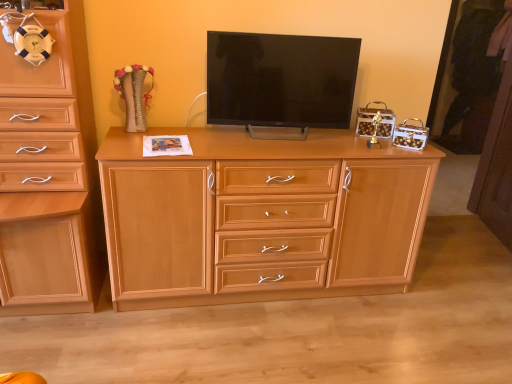
Image resolution: width=512 pixels, height=384 pixels. In order to click on light wood cabinet at left, arranged as the 2th chest of drawers when viewed from the right in this screenshot , I will do `click(49, 176)`.

Locate an element on the screen. This screenshot has width=512, height=384. light wood cabinet at left, the 1th chest of drawers from the left is located at coordinates (49, 176).

Is light wood chest of drawers at center, marked as the first chest of drawers in a right-to-left arrangement, positioned far away from light wood cabinet at left, the 1th chest of drawers from the left?

No, light wood chest of drawers at center, marked as the first chest of drawers in a right-to-left arrangement, is not far away from light wood cabinet at left, the 1th chest of drawers from the left.

Considering the relative positions of light wood chest of drawers at center, marked as the first chest of drawers in a right-to-left arrangement, and light wood cabinet at left, arranged as the 2th chest of drawers when viewed from the right, in the image provided, is light wood chest of drawers at center, marked as the first chest of drawers in a right-to-left arrangement, to the left or to the right of light wood cabinet at left, arranged as the 2th chest of drawers when viewed from the right,?

Based on their positions, light wood chest of drawers at center, marked as the first chest of drawers in a right-to-left arrangement, is located to the right of light wood cabinet at left, arranged as the 2th chest of drawers when viewed from the right.

Measure the distance between light wood chest of drawers at center, marked as the first chest of drawers in a right-to-left arrangement, and light wood cabinet at left, the 1th chest of drawers from the left.

light wood chest of drawers at center, marked as the first chest of drawers in a right-to-left arrangement, and light wood cabinet at left, the 1th chest of drawers from the left, are 64.28 centimeters apart.

Is light wood cabinet at left, arranged as the 2th chest of drawers when viewed from the right, next to light wood chest of drawers at center, placed as the second chest of drawers when sorted from left to right, and touching it?

There is a gap between light wood cabinet at left, arranged as the 2th chest of drawers when viewed from the right, and light wood chest of drawers at center, placed as the second chest of drawers when sorted from left to right.

Is light wood cabinet at left, the 1th chest of drawers from the left, to the left or to the right of light wood chest of drawers at center, placed as the second chest of drawers when sorted from left to right, in the image?

Clearly, light wood cabinet at left, the 1th chest of drawers from the left, is on the left of light wood chest of drawers at center, placed as the second chest of drawers when sorted from left to right, in the image.

Consider the image. From a real-world perspective, is light wood cabinet at left, arranged as the 2th chest of drawers when viewed from the right, positioned above or below light wood chest of drawers at center, placed as the second chest of drawers when sorted from left to right?

In terms of real-world spatial position, light wood cabinet at left, arranged as the 2th chest of drawers when viewed from the right, is above light wood chest of drawers at center, placed as the second chest of drawers when sorted from left to right.

Measure the distance between light wood cabinet at left, arranged as the 2th chest of drawers when viewed from the right, and light wood chest of drawers at center, marked as the first chest of drawers in a right-to-left arrangement.

light wood cabinet at left, arranged as the 2th chest of drawers when viewed from the right, and light wood chest of drawers at center, marked as the first chest of drawers in a right-to-left arrangement, are 25.31 inches apart.

Would you say matte black tv at center is part of light wood chest of drawers at center, marked as the first chest of drawers in a right-to-left arrangement,'s contents?

That's incorrect, matte black tv at center is not inside light wood chest of drawers at center, marked as the first chest of drawers in a right-to-left arrangement.

Considering the sizes of objects light wood chest of drawers at center, marked as the first chest of drawers in a right-to-left arrangement, and matte black tv at center in the image provided, who is taller, light wood chest of drawers at center, marked as the first chest of drawers in a right-to-left arrangement, or matte black tv at center?

With more height is light wood chest of drawers at center, marked as the first chest of drawers in a right-to-left arrangement.

Is light wood chest of drawers at center, marked as the first chest of drawers in a right-to-left arrangement, touching matte black tv at center?

No, light wood chest of drawers at center, marked as the first chest of drawers in a right-to-left arrangement, is not beside matte black tv at center.

What's the angular difference between light wood chest of drawers at center, placed as the second chest of drawers when sorted from left to right, and matte black tv at center's facing directions?

light wood chest of drawers at center, placed as the second chest of drawers when sorted from left to right, and matte black tv at center are facing 7.38 degrees away from each other.

Based on their sizes in the image, would you say matte black tv at center is bigger or smaller than light wood chest of drawers at center, marked as the first chest of drawers in a right-to-left arrangement?

Considering their sizes, matte black tv at center takes up less space than light wood chest of drawers at center, marked as the first chest of drawers in a right-to-left arrangement.

Visually, is matte black tv at center positioned to the left or to the right of light wood chest of drawers at center, marked as the first chest of drawers in a right-to-left arrangement?

From the image, it's evident that matte black tv at center is to the right of light wood chest of drawers at center, marked as the first chest of drawers in a right-to-left arrangement.

Is matte black tv at center beside light wood chest of drawers at center, marked as the first chest of drawers in a right-to-left arrangement?

No, matte black tv at center is not beside light wood chest of drawers at center, marked as the first chest of drawers in a right-to-left arrangement.

Between point (280, 57) and point (435, 167), which one is positioned in front?

The point (280, 57) is in front.

Consider the image. Is matte black tv at center to the left of light wood cabinet at left, arranged as the 2th chest of drawers when viewed from the right, from the viewer's perspective?

No.

Which object is more forward, matte black tv at center or light wood cabinet at left, arranged as the 2th chest of drawers when viewed from the right?

light wood cabinet at left, arranged as the 2th chest of drawers when viewed from the right, is in front.

Is matte black tv at center directly adjacent to light wood cabinet at left, arranged as the 2th chest of drawers when viewed from the right?

No.

Is matte black tv at center oriented away from light wood cabinet at left, the 1th chest of drawers from the left?

No, matte black tv at center is not facing away from light wood cabinet at left, the 1th chest of drawers from the left.

Does light wood cabinet at left, the 1th chest of drawers from the left, come behind matte black tv at center?

No, light wood cabinet at left, the 1th chest of drawers from the left, is closer to the camera.

What's the angular difference between light wood cabinet at left, arranged as the 2th chest of drawers when viewed from the right, and matte black tv at center's facing directions?

6.33 degrees separate the facing orientations of light wood cabinet at left, arranged as the 2th chest of drawers when viewed from the right, and matte black tv at center.

Does light wood cabinet at left, arranged as the 2th chest of drawers when viewed from the right, appear on the right side of matte black tv at center?

Incorrect, light wood cabinet at left, arranged as the 2th chest of drawers when viewed from the right, is not on the right side of matte black tv at center.

You are a GUI agent. You are given a task and a screenshot of the screen. Output one action in this format:
    pyautogui.click(x=<x>, y=<y>)
    Task: Click on the chest of drawers lying in front of the light wood chest of drawers at center, placed as the second chest of drawers when sorted from left to right
    The height and width of the screenshot is (384, 512).
    Given the screenshot: What is the action you would take?
    pyautogui.click(x=49, y=176)

Image resolution: width=512 pixels, height=384 pixels. I want to click on the chest of drawers lying below the light wood cabinet at left, the 1th chest of drawers from the left (from the image's perspective), so click(x=260, y=217).

Based on their spatial positions, is light wood cabinet at left, the 1th chest of drawers from the left, or matte black tv at center closer to light wood chest of drawers at center, placed as the second chest of drawers when sorted from left to right?

matte black tv at center is positioned closer to the anchor light wood chest of drawers at center, placed as the second chest of drawers when sorted from left to right.

Looking at this image, which object lies nearer to the anchor point light wood cabinet at left, arranged as the 2th chest of drawers when viewed from the right, matte black tv at center or light wood chest of drawers at center, placed as the second chest of drawers when sorted from left to right?

light wood chest of drawers at center, placed as the second chest of drawers when sorted from left to right, is closer to light wood cabinet at left, arranged as the 2th chest of drawers when viewed from the right.

Consider the image. When comparing their distances from light wood chest of drawers at center, placed as the second chest of drawers when sorted from left to right, does matte black tv at center or light wood cabinet at left, the 1th chest of drawers from the left, seem closer?

matte black tv at center is closer to light wood chest of drawers at center, placed as the second chest of drawers when sorted from left to right.

Looking at this image, considering their positions, is light wood cabinet at left, the 1th chest of drawers from the left, positioned further to matte black tv at center than light wood chest of drawers at center, placed as the second chest of drawers when sorted from left to right?

light wood cabinet at left, the 1th chest of drawers from the left, is further to matte black tv at center.

Estimate the real-world distances between objects in this image. Which object is further from matte black tv at center, light wood chest of drawers at center, placed as the second chest of drawers when sorted from left to right, or light wood cabinet at left, the 1th chest of drawers from the left?

light wood cabinet at left, the 1th chest of drawers from the left.

Considering their positions, is light wood chest of drawers at center, placed as the second chest of drawers when sorted from left to right, positioned closer to light wood cabinet at left, the 1th chest of drawers from the left, than matte black tv at center?

light wood chest of drawers at center, placed as the second chest of drawers when sorted from left to right, is closer to light wood cabinet at left, the 1th chest of drawers from the left.

Locate an element on the screen. the chest of drawers located between light wood cabinet at left, the 1th chest of drawers from the left, and matte black tv at center in the left-right direction is located at coordinates (260, 217).